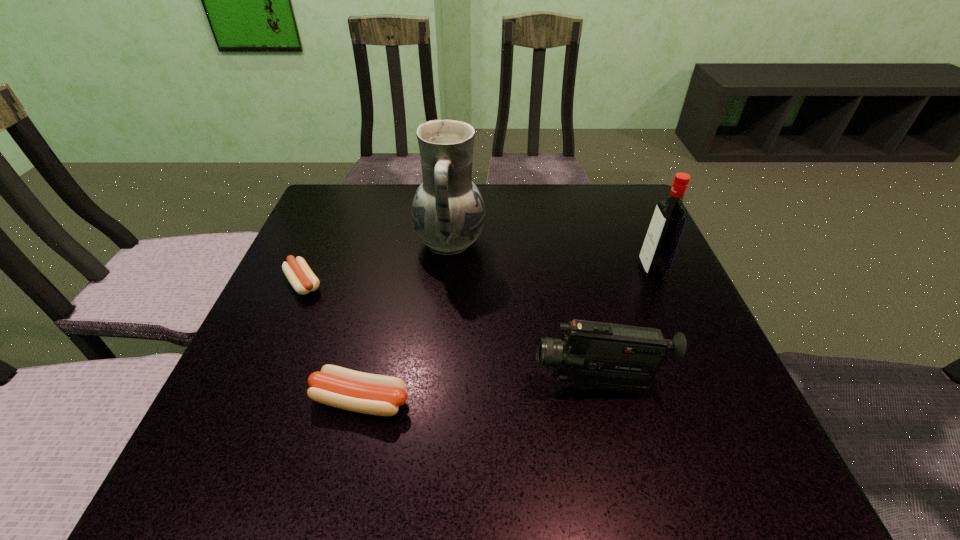
At what (x,y) coordinates should I click in order to perform the action: click on empty space between the camcorder and the taller sausage. Please return your answer as a coordinate pair (x, y). The width and height of the screenshot is (960, 540). Looking at the image, I should click on (479, 393).

Find the location of a particular element. Image resolution: width=960 pixels, height=540 pixels. free space between the second tallest object and the pitcher is located at coordinates (551, 256).

Where is `unoccupied area between the third shortest object and the pitcher`? unoccupied area between the third shortest object and the pitcher is located at coordinates (523, 314).

The image size is (960, 540). I want to click on vacant space that's between the pitcher and the second shortest object, so click(405, 322).

Find the location of a particular element. Image resolution: width=960 pixels, height=540 pixels. unoccupied area between the rightmost object and the farther sausage is located at coordinates (478, 277).

Select which object is the fourth closest to the fourth tallest object. Please provide its 2D coordinates. Your answer should be formatted as a tuple, i.e. [(x, y)], where the tuple contains the x and y coordinates of a point satisfying the conditions above.

[(663, 236)]

Choose which object is the fourth nearest neighbor to the rightmost object. Please provide its 2D coordinates. Your answer should be formatted as a tuple, i.e. [(x, y)], where the tuple contains the x and y coordinates of a point satisfying the conditions above.

[(301, 277)]

This screenshot has height=540, width=960. I want to click on free location that satisfies the following two spatial constraints: 1. on the front side of the nearer sausage; 2. on the right side of the shortest object, so click(x=252, y=401).